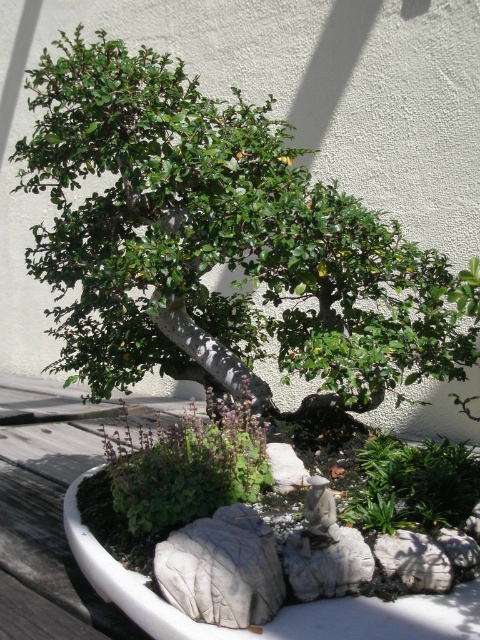
Question: Which of the following is the closest to the observer?

Choices:
 (A) (218, 406)
 (B) (296, 204)

Answer: (B)

Question: Is green leafy bonsai at center bigger than green leafy plant at center?

Choices:
 (A) yes
 (B) no

Answer: (A)

Question: Is green leafy bonsai at center thinner than green leafy plant at center?

Choices:
 (A) yes
 (B) no

Answer: (B)

Question: Can you confirm if green leafy bonsai at center is wider than green leafy plant at center?

Choices:
 (A) yes
 (B) no

Answer: (A)

Question: Which point appears closest to the camera in this image?

Choices:
 (A) (157, 476)
 (B) (231, 214)

Answer: (A)

Question: Which point appears farthest from the camera in this image?

Choices:
 (A) (271, 291)
 (B) (197, 456)

Answer: (A)